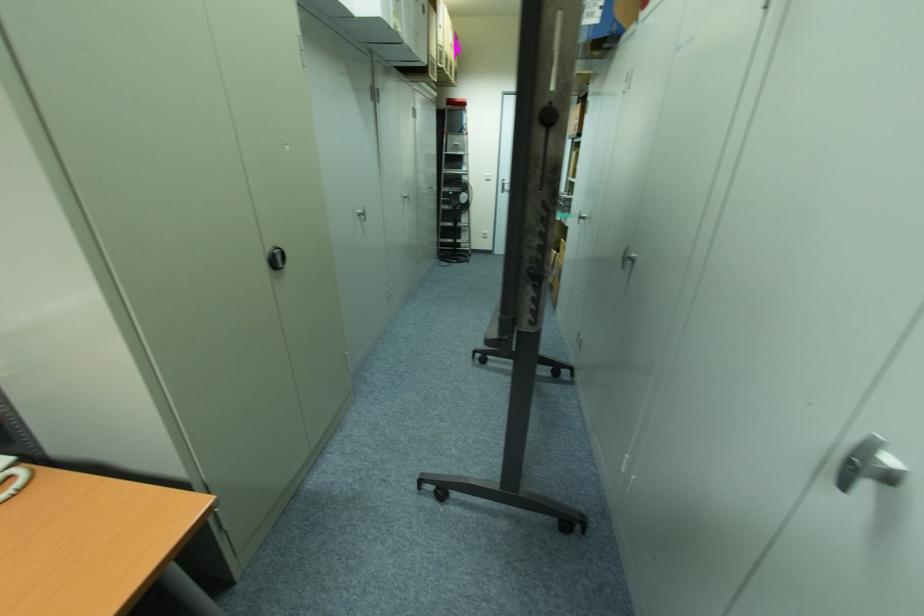
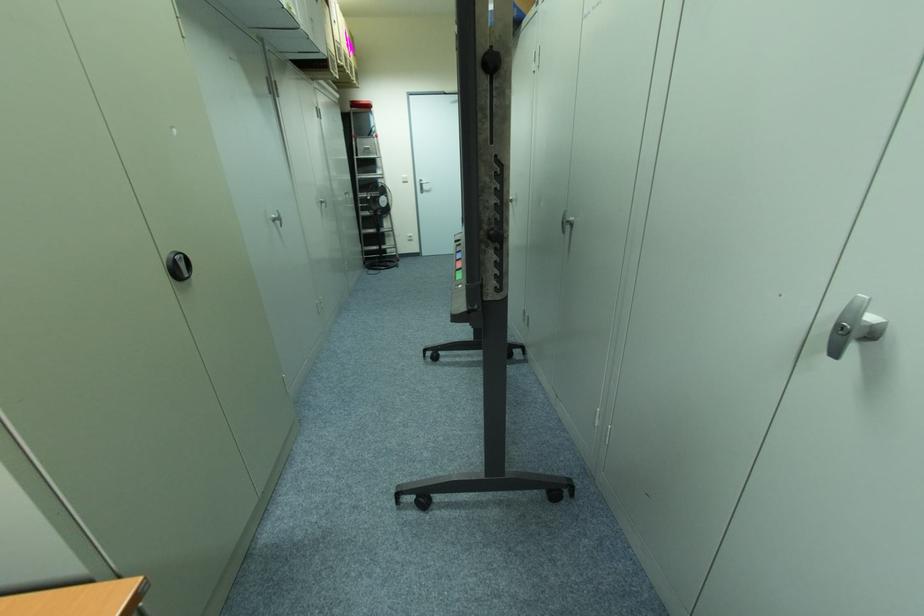
Question: I am providing you with two images of the same scene from different viewpoints. Please identify which objects are invisible in image2.

Choices:
 (A) white door handle
 (B) black adjustment knob
 (C) silver cabinet handle
 (D) none of these

Answer: (D)